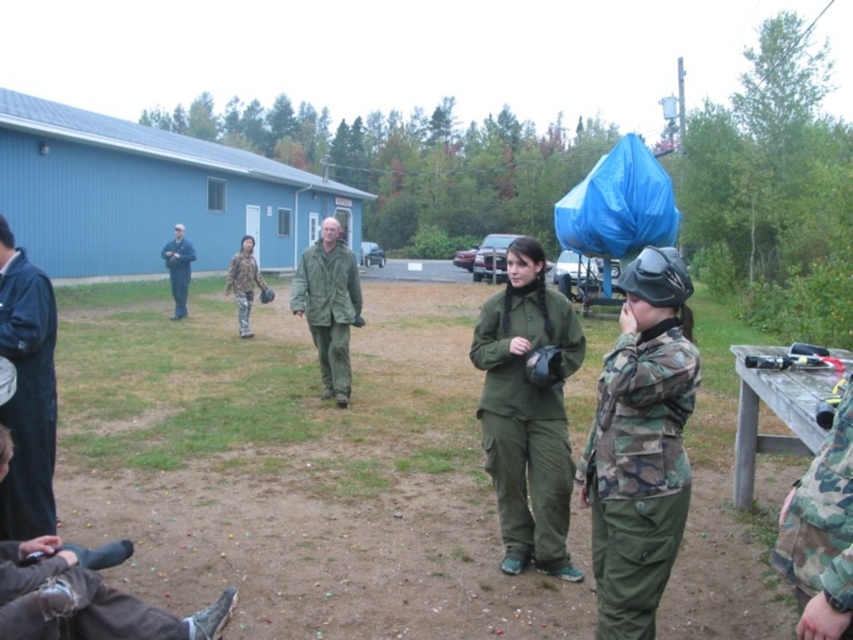
Question: Which of the following is the farthest from the observer?

Choices:
 (A) green matte jacket at center
 (B) camo fabric uniform at center
 (C) matte black uniform at left
 (D) green matte uniform at center

Answer: (C)

Question: Which is nearer to the brown suede boots at lower left?

Choices:
 (A) denim jacket at left
 (B) green matte jacket at center
 (C) camouflage fabric uniform at center
 (D) camo fabric uniform at center

Answer: (A)

Question: Is denim jacket at left smaller than matte black uniform at left?

Choices:
 (A) yes
 (B) no

Answer: (A)

Question: Does brown suede boots at lower left come behind matte black uniform at left?

Choices:
 (A) no
 (B) yes

Answer: (A)

Question: Which of these objects is positioned farthest from the camo fabric uniform at right?

Choices:
 (A) matte black uniform at left
 (B) denim jacket at left
 (C) brown suede boots at lower left

Answer: (A)

Question: Is camo fabric uniform at center further to camera compared to brown suede boots at lower left?

Choices:
 (A) no
 (B) yes

Answer: (B)